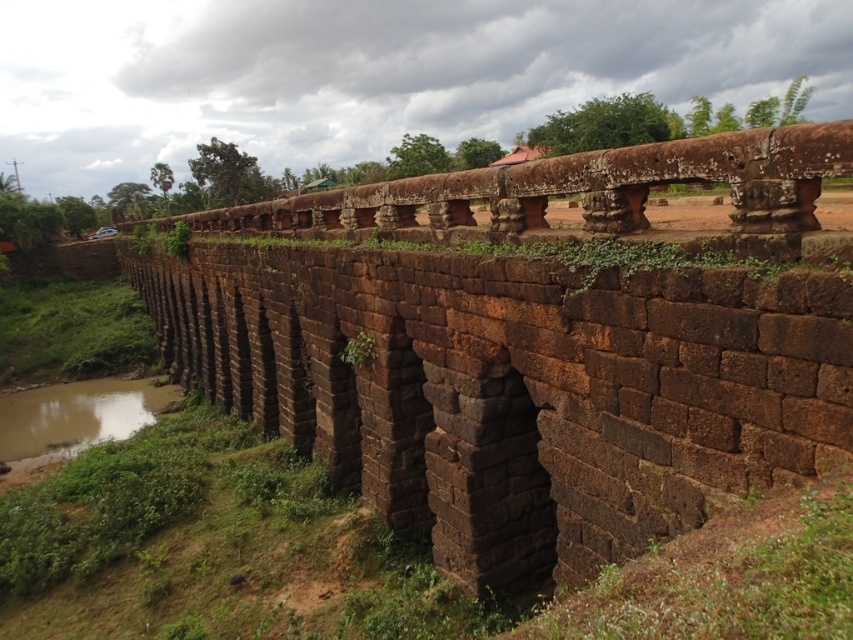
Looking at this image, measure the distance between brown stone viaduct at center and camera.

A distance of 4.56 meters exists between brown stone viaduct at center and camera.

Can you confirm if brown stone viaduct at center is taller than brown stone bridge at center?

Indeed, brown stone viaduct at center has a greater height compared to brown stone bridge at center.

At what (x,y) coordinates should I click in order to perform the action: click on brown stone viaduct at center. Please return your answer as a coordinate pair (x, y). Looking at the image, I should click on (527, 348).

Is brown stone bridge at center in front of brown muddy water at lower left?

Yes, it is in front of brown muddy water at lower left.

Can you confirm if brown stone bridge at center is smaller than brown muddy water at lower left?

Incorrect, brown stone bridge at center is not smaller in size than brown muddy water at lower left.

Between point (432, 221) and point (80, 445), which one is positioned in front?

Positioned in front is point (432, 221).

The height and width of the screenshot is (640, 853). In order to click on brown stone bridge at center in this screenshot , I will do `click(577, 188)`.

Is brown stone viaduct at center below brown muddy water at lower left?

No.

Is point (618, 396) farther from camera compared to point (56, 440)?

No, it is not.

The image size is (853, 640). I want to click on brown stone viaduct at center, so click(x=527, y=348).